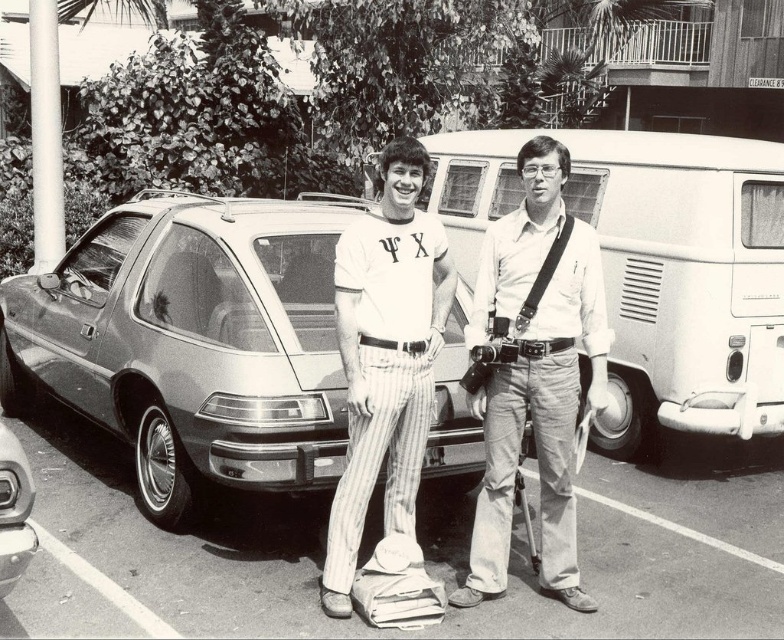
Question: Among these objects, which one is farthest from the camera?

Choices:
 (A) metallic silver minivan at center
 (B) white matte van at center
 (C) shiny chrome bumper at lower left
 (D) matte white shirt at center

Answer: (B)

Question: Which point appears farthest from the camera in this image?

Choices:
 (A) (303, 209)
 (B) (367, 465)
 (C) (518, 336)

Answer: (A)

Question: Can you confirm if matte white shirt at center is wider than white striped pants at center?

Choices:
 (A) yes
 (B) no

Answer: (A)

Question: Which point is farther to the camera?

Choices:
 (A) click(648, 161)
 (B) click(6, 460)

Answer: (A)

Question: Does metallic silver minivan at center have a greater width compared to matte white shirt at center?

Choices:
 (A) yes
 (B) no

Answer: (A)

Question: Is white matte van at center positioned in front of shiny chrome bumper at lower left?

Choices:
 (A) yes
 (B) no

Answer: (B)